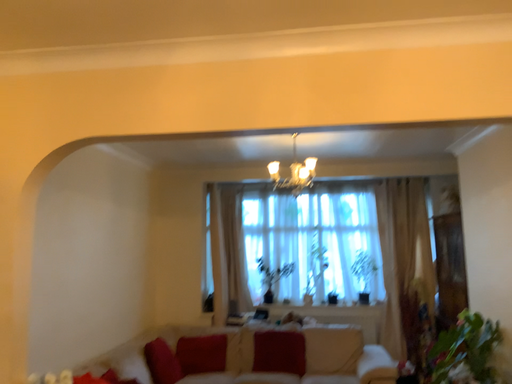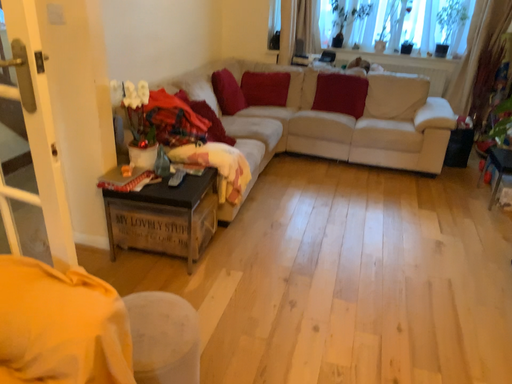
Question: Which way did the camera rotate in the video?

Choices:
 (A) rotated right
 (B) rotated left

Answer: (B)